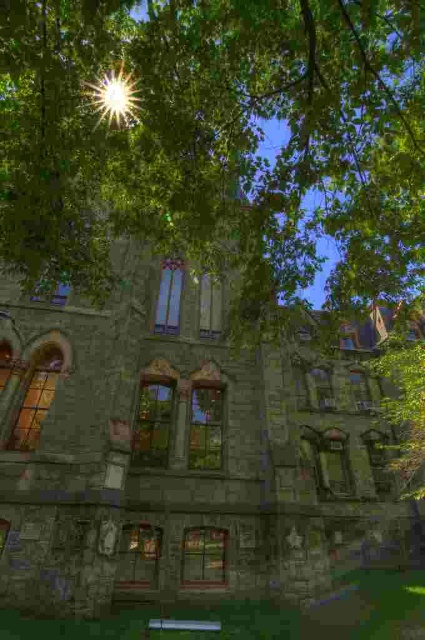
Question: Is green leafy tree at center smaller than bright sun at upper center?

Choices:
 (A) no
 (B) yes

Answer: (A)

Question: Which of the following is the closest to the observer?

Choices:
 (A) bright sun at upper center
 (B) green leafy tree at center

Answer: (B)

Question: Which point is closer to the camera?

Choices:
 (A) (127, 113)
 (B) (226, 90)

Answer: (A)

Question: Is the position of green leafy tree at center more distant than that of bright sun at upper center?

Choices:
 (A) yes
 (B) no

Answer: (B)

Question: In this image, where is green leafy tree at center located relative to bright sun at upper center?

Choices:
 (A) right
 (B) left

Answer: (A)